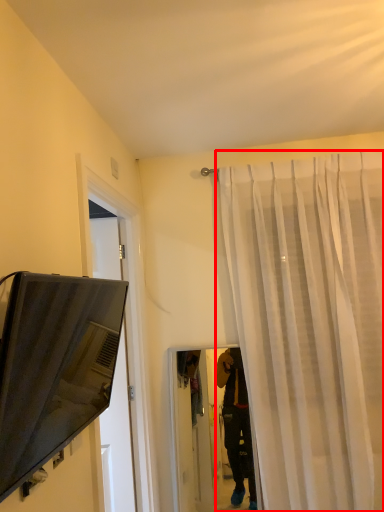
Question: Observing the image, what is the correct spatial positioning of curtain (annotated by the red box) in reference to television?

Choices:
 (A) left
 (B) right

Answer: (B)